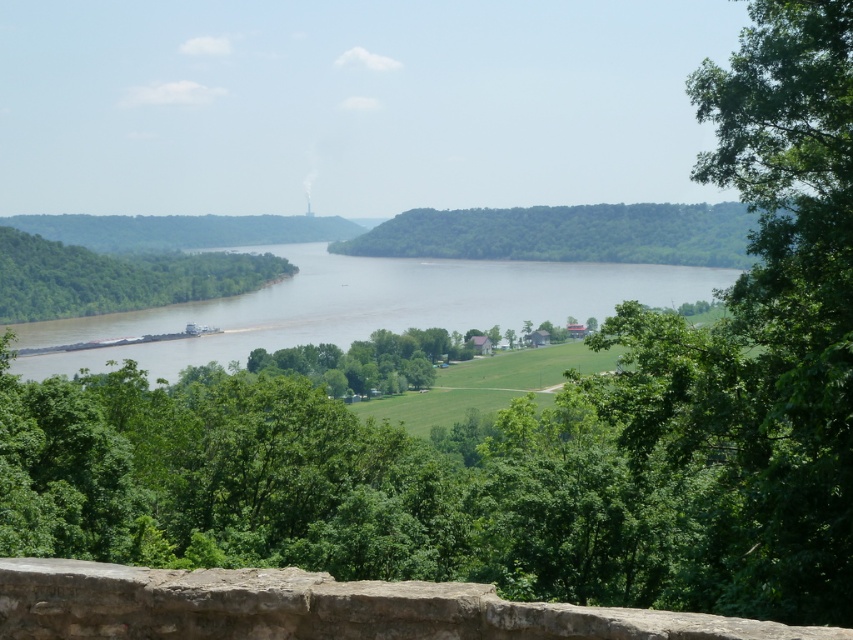
You are a hiker standing on the rustic stone ledge at lower center. You want to take a photo of the green leafy tree at left. Which direction should you face to capture the tree in your view?

The rustic stone ledge at lower center is below the green leafy tree at left, so you should face upward to capture the tree in your view.

You are standing at the viewpoint and want to place a small garden statue on the rustic stone ledge at lower center. Considering the size of the green leafy hill at center, will the statue fit comfortably?

The rustic stone ledge at lower center is smaller than the green leafy hill at center, so the statue may not fit comfortably as the ledge is not as large as the hill.